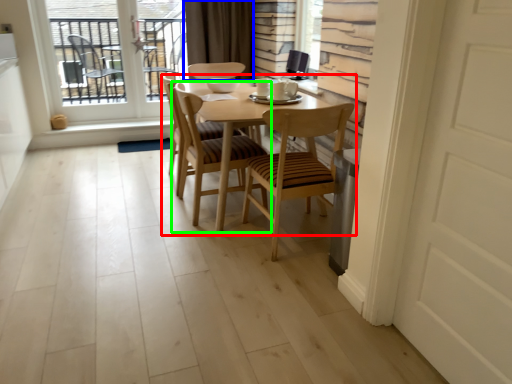
Question: Based on their relative distances, which object is nearer to kitchen & dining room table (highlighted by a red box)? Choose from curtain (highlighted by a blue box) and chair (highlighted by a green box).

Choices:
 (A) curtain
 (B) chair

Answer: (B)